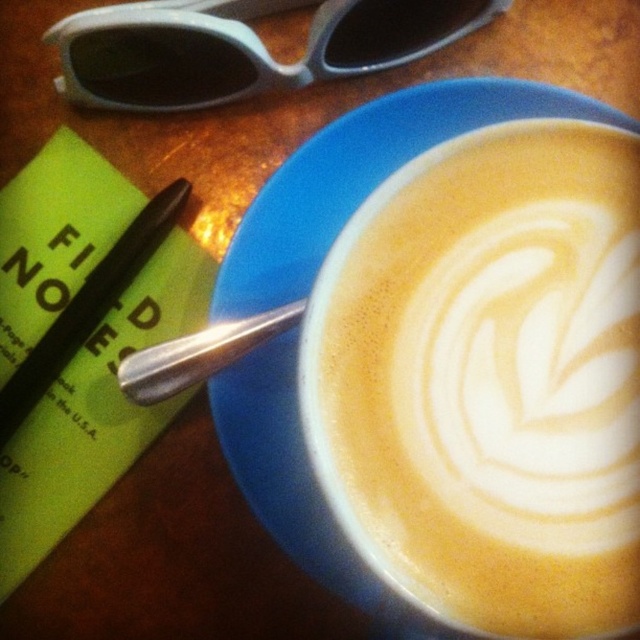
Question: Which point appears closest to the camera in this image?

Choices:
 (A) (602, 497)
 (B) (216, 17)
 (C) (138, 228)
 (D) (188, 364)

Answer: (A)

Question: Which point is closer to the camera?

Choices:
 (A) (268, 324)
 (B) (625, 260)
 (C) (148, 17)
 (D) (173, 182)

Answer: (B)

Question: Which point is farther from the camera taking this photo?

Choices:
 (A) (465, 516)
 (B) (131, 385)
 (C) (282, 68)

Answer: (C)

Question: Does matte plastic sunglasses at upper left have a larger size compared to silver metallic spoon at lower left?

Choices:
 (A) no
 (B) yes

Answer: (B)

Question: Is foamy white coffee at center smaller than black matte pen at lower left?

Choices:
 (A) yes
 (B) no

Answer: (A)

Question: Is matte plastic sunglasses at upper left to the right of black matte pen at lower left from the viewer's perspective?

Choices:
 (A) no
 (B) yes

Answer: (B)